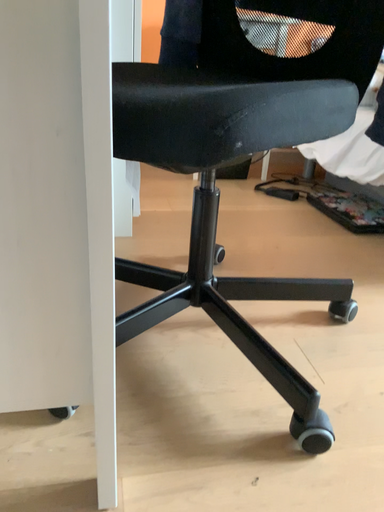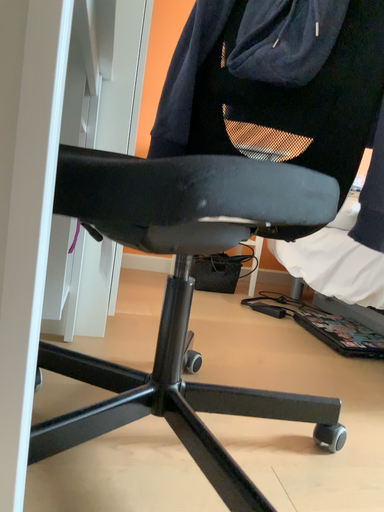
Question: Which way did the camera rotate in the video?

Choices:
 (A) rotated upward
 (B) rotated downward

Answer: (A)